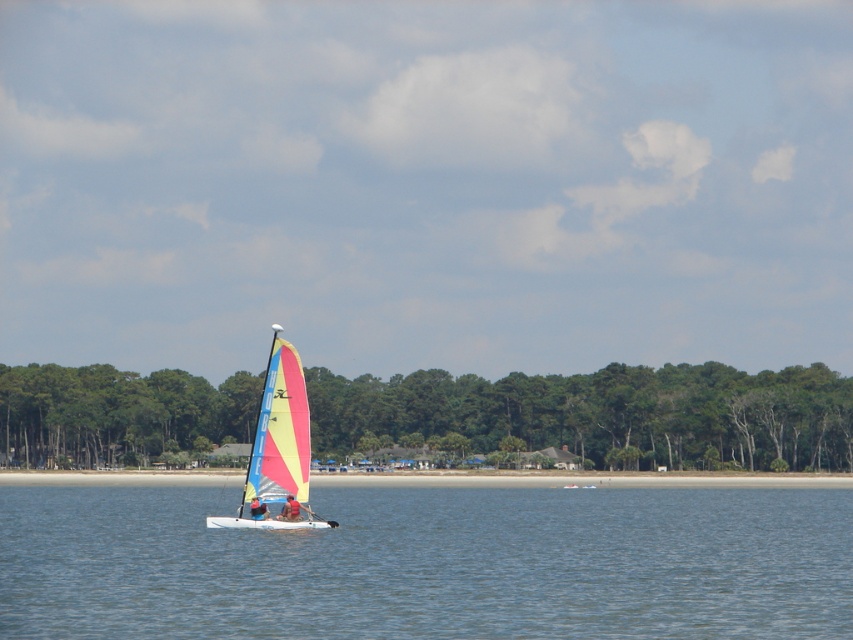
You are a photographer trying to capture the entire scene of the smooth tan skin at center and the red fabric sailboat at center in one shot. Based on their sizes, which object should you focus on to ensure both are visible without cropping?

The smooth tan skin at center is much taller than the red fabric sailboat at center, so you should focus on the smooth tan skin at center to ensure both are visible without cropping.

You are a photographer planning to take a wide shot of the scene. Given that you want to include both the clear blue water at center and the smooth tan skin at center in your photo, which one will occupy more of the frame?

The clear blue water at center is larger in size than the smooth tan skin at center, so it will occupy more of the frame in the photo.